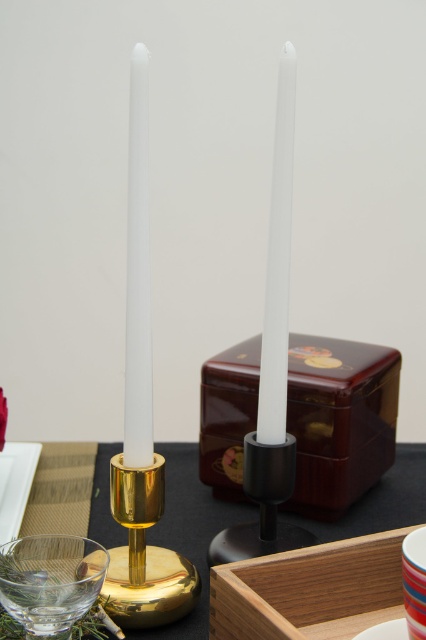
Between gold metallic candlestick at center and matte red saucer at lower right, which one has less height?

matte red saucer at lower right

Does gold metallic candlestick at center appear on the left side of matte red saucer at lower right?

Correct, you'll find gold metallic candlestick at center to the left of matte red saucer at lower right.

Describe the element at coordinates (189, 532) in the screenshot. The height and width of the screenshot is (640, 426). I see `gold metallic candlestick at center` at that location.

At what (x,y) coordinates should I click in order to perform the action: click on gold metallic candlestick at center. Please return your answer as a coordinate pair (x, y). This screenshot has width=426, height=640. Looking at the image, I should click on click(189, 532).

Between white matte candle at left and white matte candle at center, which one has less height?

white matte candle at center

Is white matte candle at left positioned before white matte candle at center?

Yes, it is.

Between point (131, 381) and point (276, 406), which one is positioned behind?

Positioned behind is point (276, 406).

The height and width of the screenshot is (640, 426). What are the coordinates of `white matte candle at left` in the screenshot? It's located at [138, 276].

Can you confirm if white matte candle at left is bigger than matte red saucer at lower right?

Yes, white matte candle at left is bigger than matte red saucer at lower right.

Image resolution: width=426 pixels, height=640 pixels. What do you see at coordinates (138, 276) in the screenshot? I see `white matte candle at left` at bounding box center [138, 276].

I want to click on white matte candle at left, so click(x=138, y=276).

Identify the location of white matte candle at left. The width and height of the screenshot is (426, 640). (138, 276).